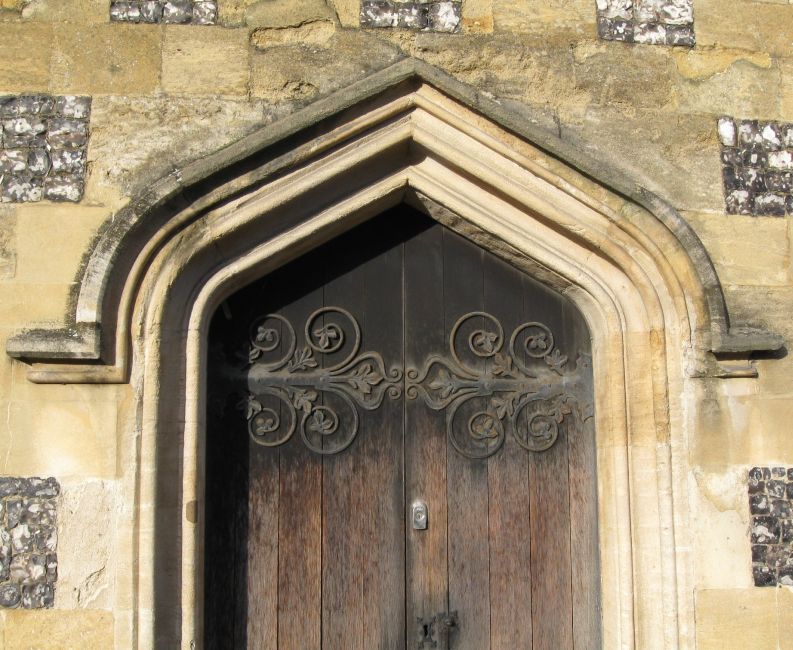
This screenshot has height=650, width=793. Find the location of `handle`. handle is located at coordinates (433, 628).